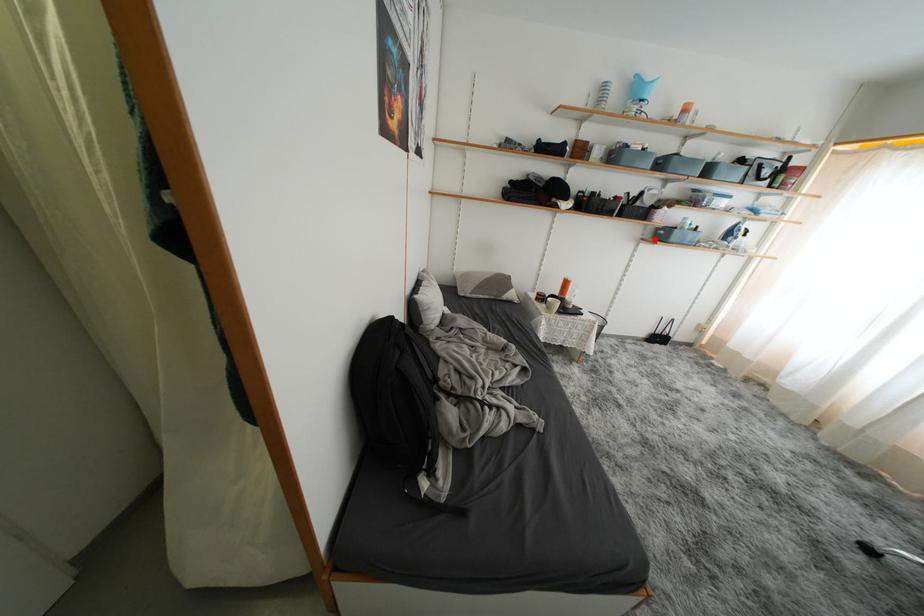
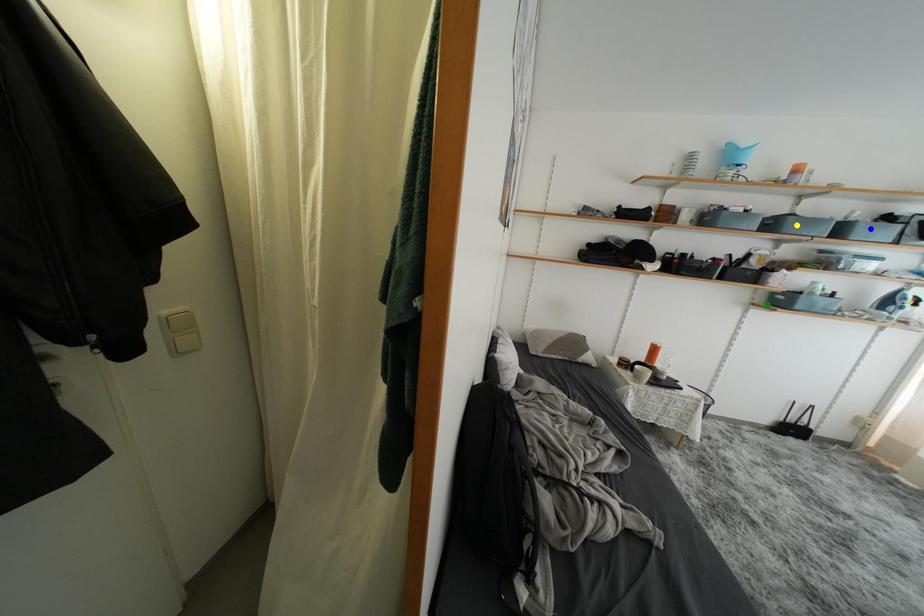
Question: I am providing you with two images of the same scene from different viewpoints. A red point is marked on the first image. You are given multiple points on the second image. Which spot in image 2 lines up with the point in image 1?

Choices:
 (A) blue point
 (B) green point
 (C) yellow point

Answer: (B)